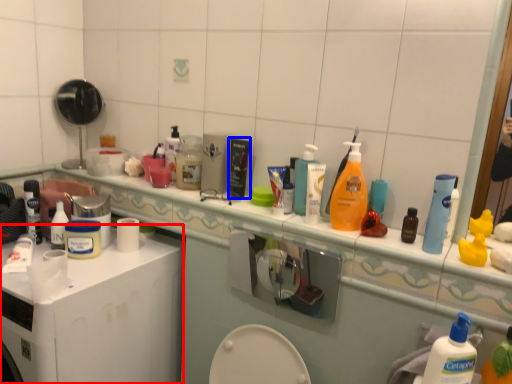
Question: Which point is closer to the camera, washing machine (highlighted by a red box) or product (highlighted by a blue box)?

Choices:
 (A) washing machine
 (B) product

Answer: (A)